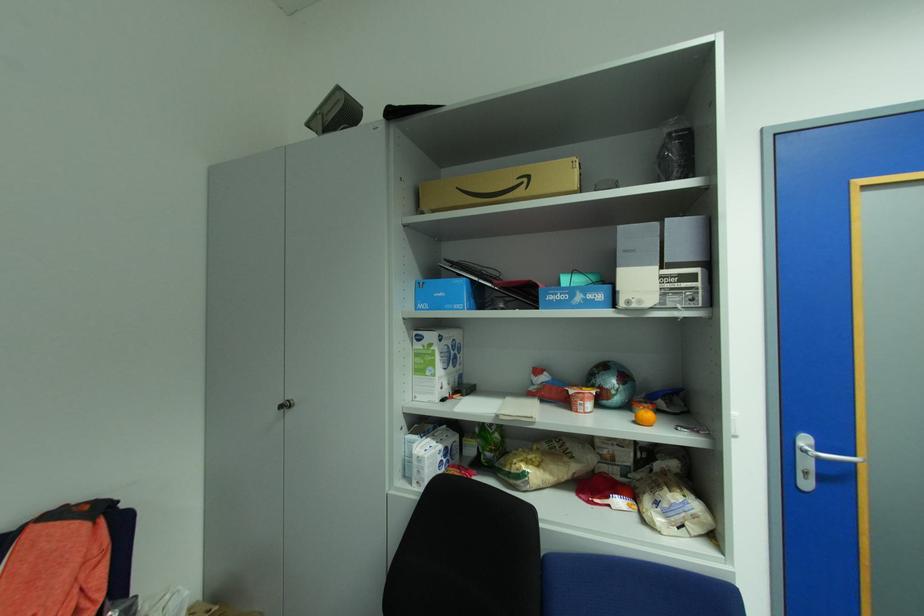
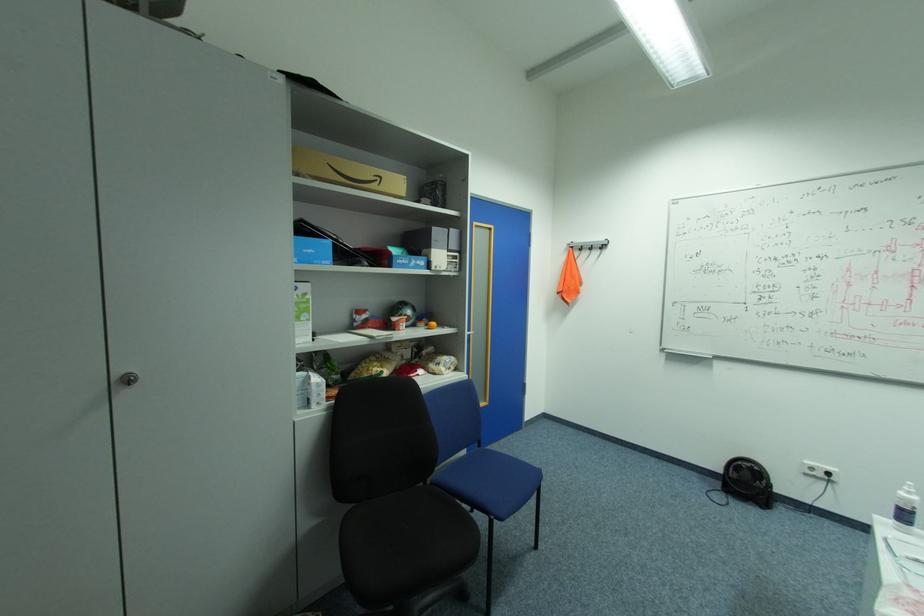
In the second image, find the point that corresponds to (293,406) in the first image.

(137, 379)